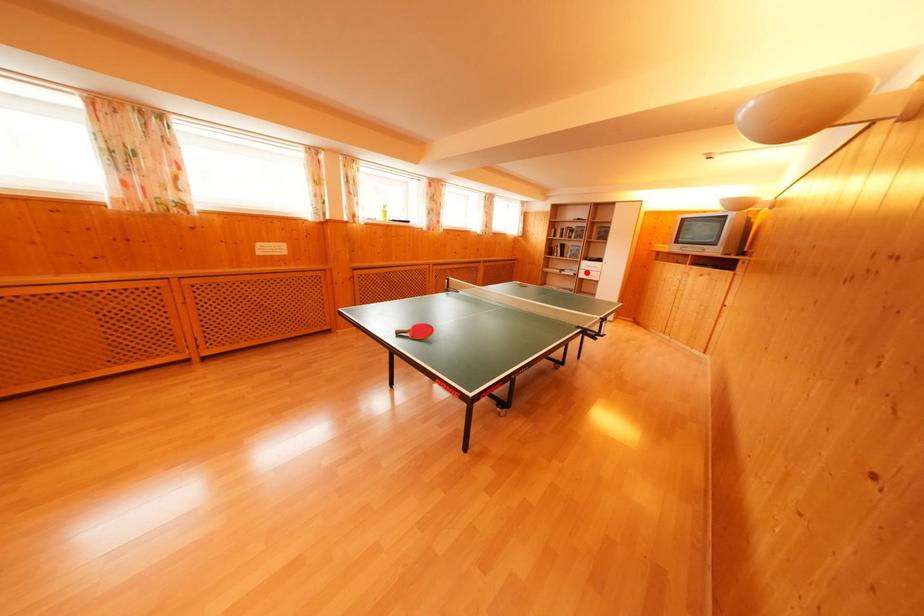
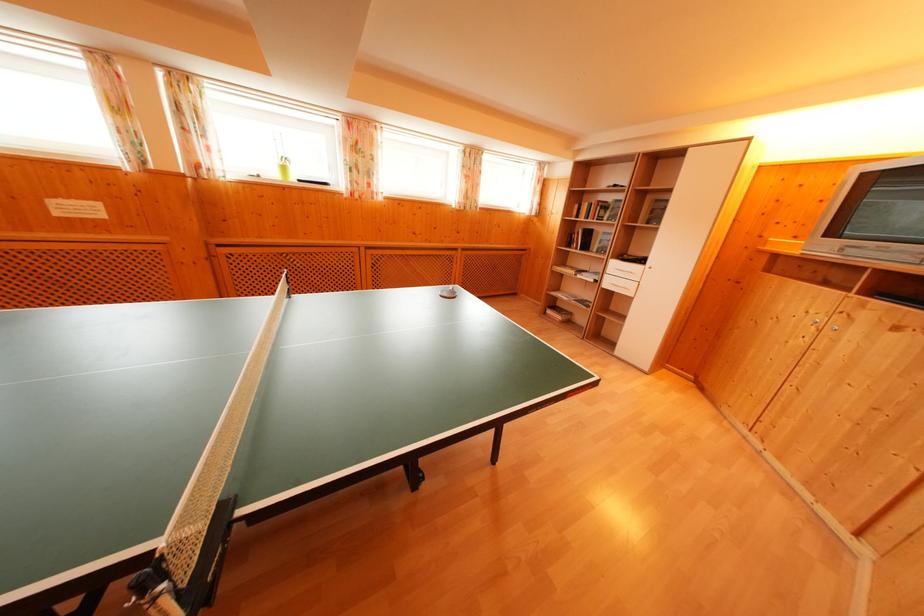
Where in the second image is the point corresponding to the highlighted location from the first image?

(614, 276)